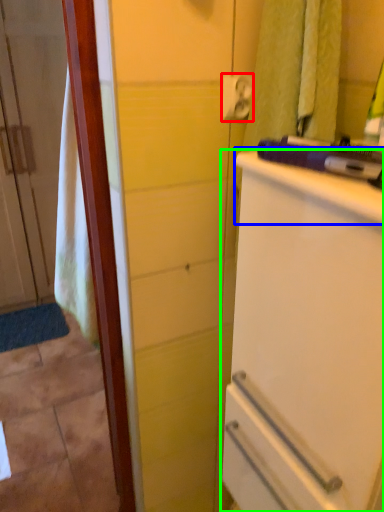
Question: Estimate the real-world distances between objects in this image. Which object is closer to towel bar (highlighted by a red box), counter top (highlighted by a blue box) or refrigerator (highlighted by a green box)?

Choices:
 (A) counter top
 (B) refrigerator

Answer: (A)